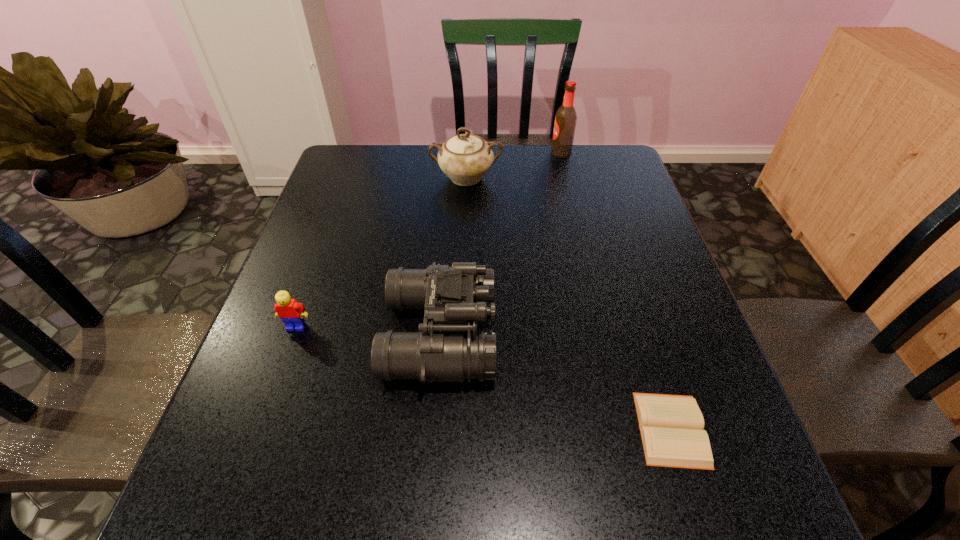
Locate an element on the screen. Image resolution: width=960 pixels, height=540 pixels. free space located on the front-facing side of the second shortest object is located at coordinates (275, 387).

The image size is (960, 540). Identify the location of free region located 0.350m on the back of the diary. (619, 263).

I want to click on beer bottle at the far edge, so click(x=565, y=119).

Where is `chinaware that is positioned at the far edge`? The height and width of the screenshot is (540, 960). chinaware that is positioned at the far edge is located at coordinates (465, 158).

This screenshot has height=540, width=960. Identify the location of object positioned at the left edge. (291, 312).

The image size is (960, 540). In order to click on object present at the right edge in this screenshot , I will do `click(671, 426)`.

Locate an element on the screen. vacant space at the far edge of the desktop is located at coordinates (544, 182).

This screenshot has width=960, height=540. Find the location of `vacant region at the near edge of the desktop`. vacant region at the near edge of the desktop is located at coordinates (331, 517).

In order to click on free space at the left edge of the desktop in this screenshot , I will do click(338, 308).

What are the coordinates of `vacant region at the right edge of the desktop` in the screenshot? It's located at (612, 266).